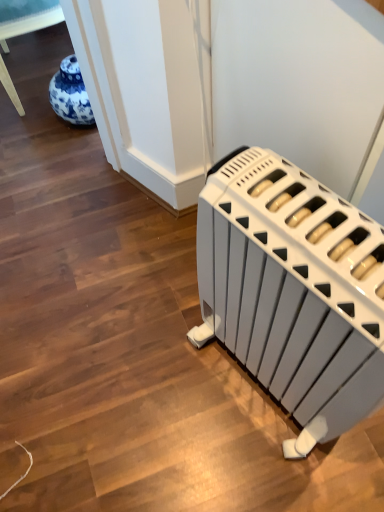
Image resolution: width=384 pixels, height=512 pixels. I want to click on free spot above white plastic heater at lower right (from a real-world perspective), so click(315, 231).